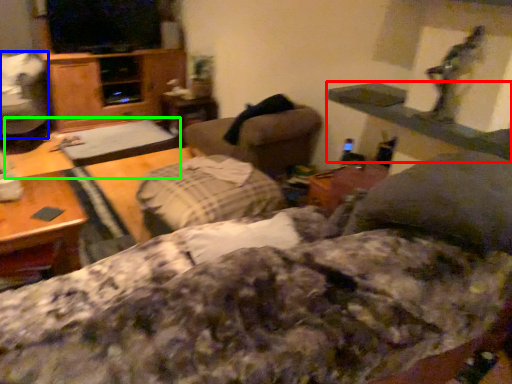
Question: Which object is the farthest from table (highlighted by a red box)? Choose among these: swivel chair (highlighted by a blue box) or table (highlighted by a green box).

Choices:
 (A) swivel chair
 (B) table

Answer: (A)